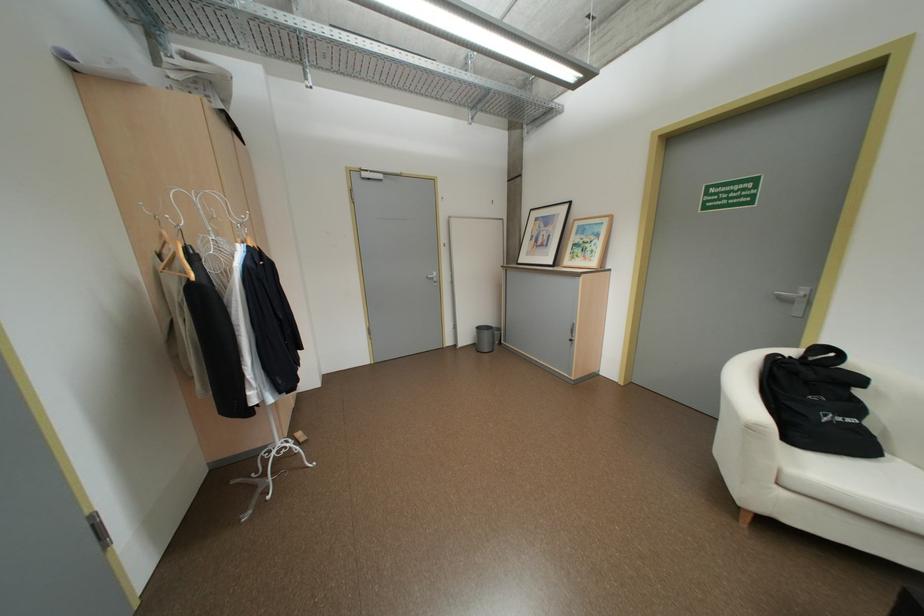
Which object does [484,338] point to?

This point indicates the metal trash can.